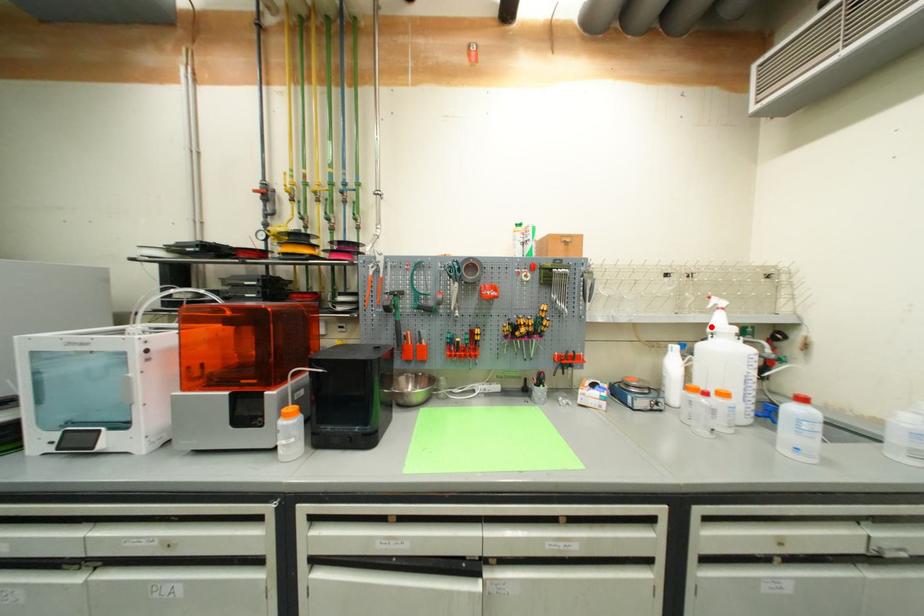
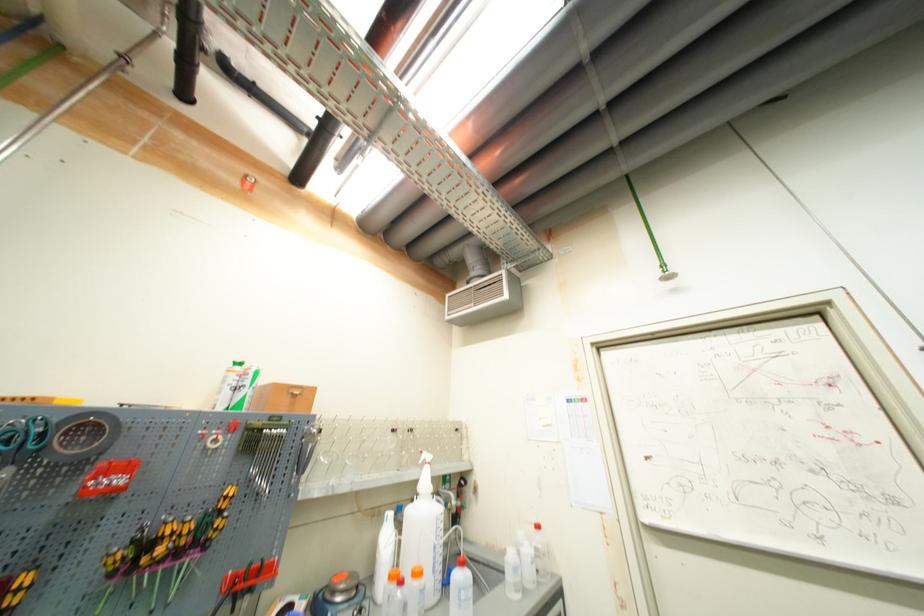
Find the pixel in the second image that matches the highlighted location in the first image.

(421, 484)